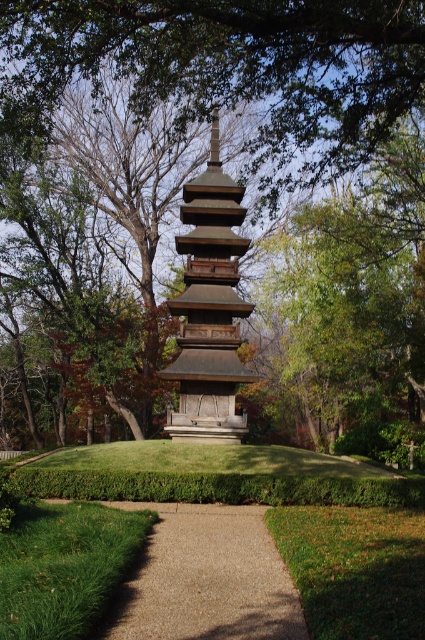
Does green leafy tree at center lie behind brown wooden pagoda at center?

No.

Image resolution: width=425 pixels, height=640 pixels. In order to click on green leafy tree at center in this screenshot , I will do `click(243, 61)`.

Find the location of a particular element. This screenshot has width=425, height=640. green leafy tree at center is located at coordinates (243, 61).

Can you confirm if green leafy tree at center is wider than gravel path at center?

Correct, the width of green leafy tree at center exceeds that of gravel path at center.

Looking at this image, which is above, green leafy tree at center or gravel path at center?

green leafy tree at center is above.

The width and height of the screenshot is (425, 640). What are the coordinates of `green leafy tree at center` in the screenshot? It's located at (243, 61).

Between gravel path at center and brown wooden pagoda at center, which one has more height?

Standing taller between the two is brown wooden pagoda at center.

Between gravel path at center and brown wooden pagoda at center, which one is positioned higher?

Positioned higher is brown wooden pagoda at center.

Who is more forward, (263, 580) or (180, 304)?

Point (263, 580) is more forward.

Where is `gravel path at center`? gravel path at center is located at coordinates (206, 579).